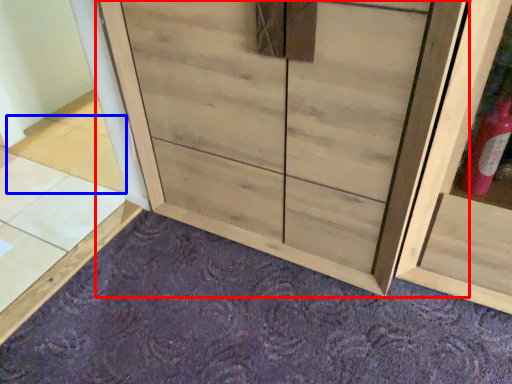
Question: Which object appears farthest to the camera in this image, cupboard (highlighted by a red box) or tile (highlighted by a blue box)?

Choices:
 (A) cupboard
 (B) tile

Answer: (B)